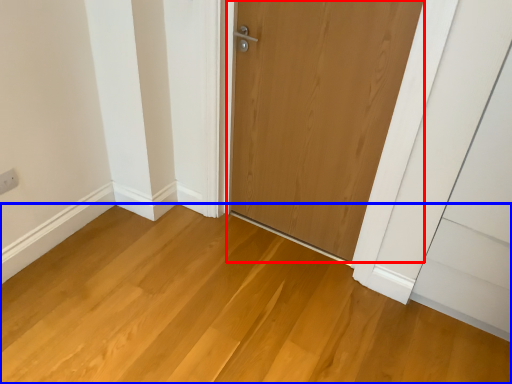
Question: Among these objects, which one is farthest to the camera, door (highlighted by a red box) or plain (highlighted by a blue box)?

Choices:
 (A) door
 (B) plain

Answer: (A)